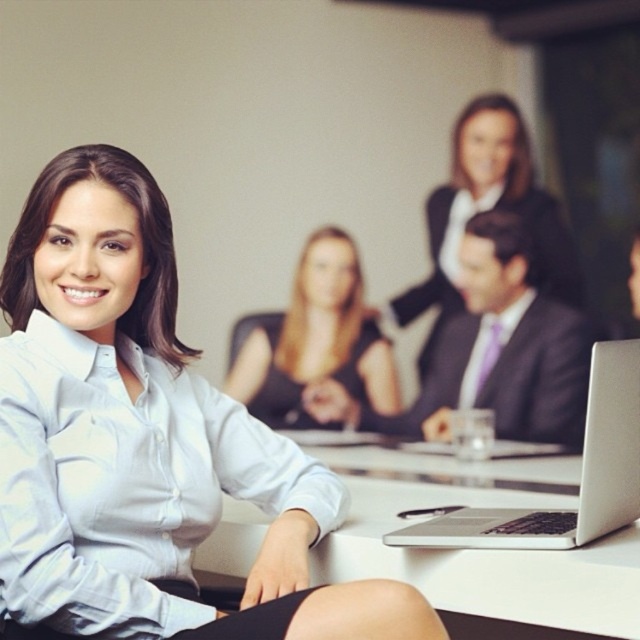
You are a photographer setting up for a group photo in the conference room. You notice two dark outfits at the center table. Which one is positioned to the left of the other? The options are the black glossy dress at center and the matte black suit at center.

The black glossy dress at center is positioned to the left of the matte black suit at center.

In the scene shown: You are standing at the point labeled point (250, 380) and want to see the person sitting at point (476, 401). Can you see them clearly from your position?

Point (250, 380) is behind point (476, 401), so you cannot see them clearly from your position.